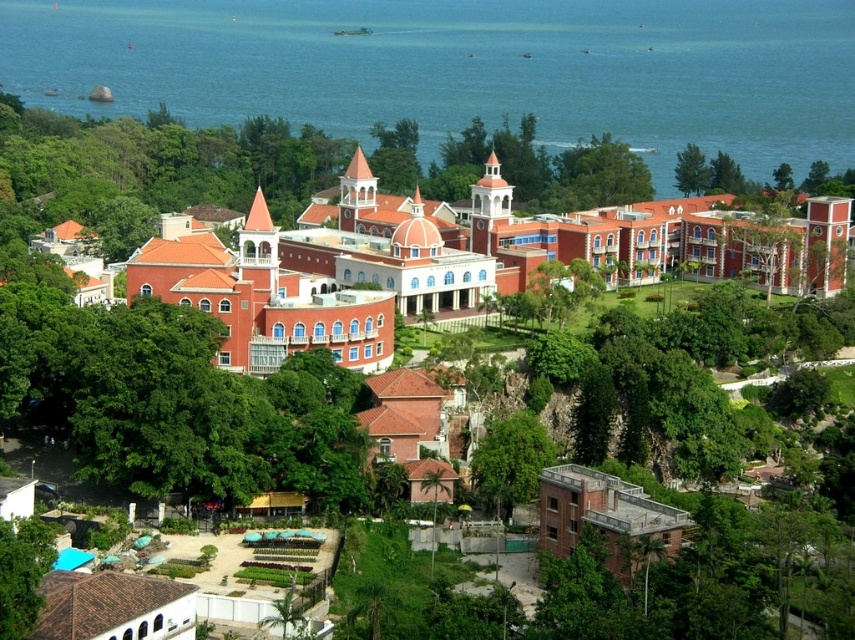
Does green leafy tree at center have a smaller size compared to green leafy tree at lower left?

Incorrect, green leafy tree at center is not smaller in size than green leafy tree at lower left.

At what (x,y) coordinates should I click in order to perform the action: click on green leafy tree at center. Please return your answer as a coordinate pair (x, y). The image size is (855, 640). Looking at the image, I should click on (510, 461).

Does blue water at upper center appear under green leafy tree at center?

Incorrect, blue water at upper center is not positioned below green leafy tree at center.

Is point (747, 99) positioned behind point (519, 493)?

That is True.

What are the coordinates of `blue water at upper center` in the screenshot? It's located at (464, 68).

Describe the element at coordinates (464, 68) in the screenshot. I see `blue water at upper center` at that location.

Identify the location of blue water at upper center. (464, 68).